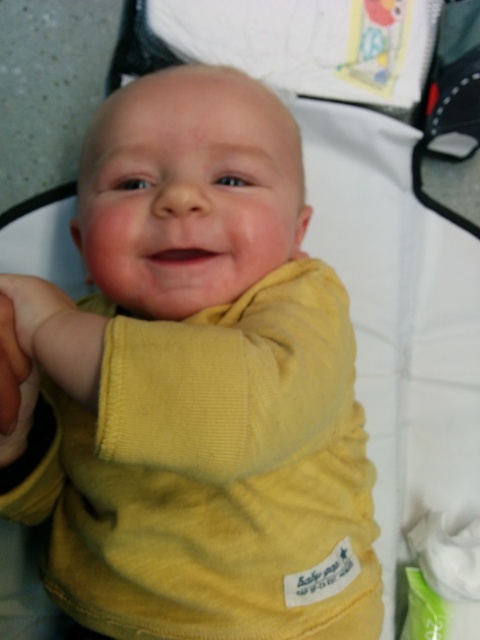
You are a photographer trying to capture a closeup of the white soft cloth at lower right without moving the baby. Since the yellow corduroy baby at center is in the way, can you adjust your camera angle to the right to get a clear shot?

The yellow corduroy baby at center is positioned on the left side of white soft cloth at lower right, so adjusting the camera angle to the right might allow you to capture the white soft cloth at lower right without obstruction from the baby.

Looking at this image, you are a caregiver holding a baby and need to reach for the white soft cloth at lower right. The baby is currently at the center. Based on the scene, can you safely grab the cloth without moving the yellow corduroy baby at center?

The distance between the yellow corduroy baby at center and the white soft cloth at lower right is 19.70 inches, so you can safely reach the cloth without moving the baby.

You are a photographer setting up for a baby photoshoot. You have a yellow corduroy baby at center and a white soft cloth at lower right in the frame. Based on the scene, which object is wider?

The yellow corduroy baby at center is wider than the white soft cloth at lower right.